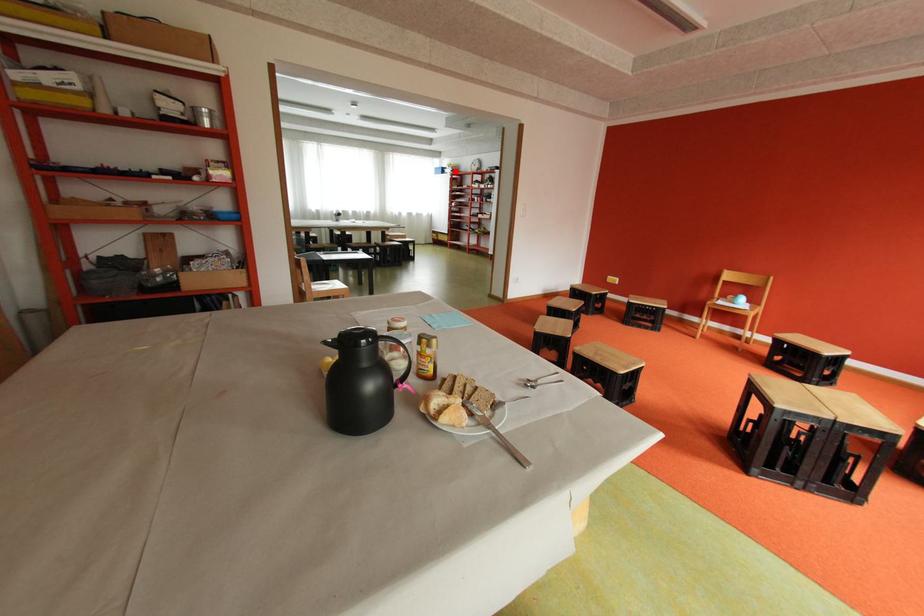
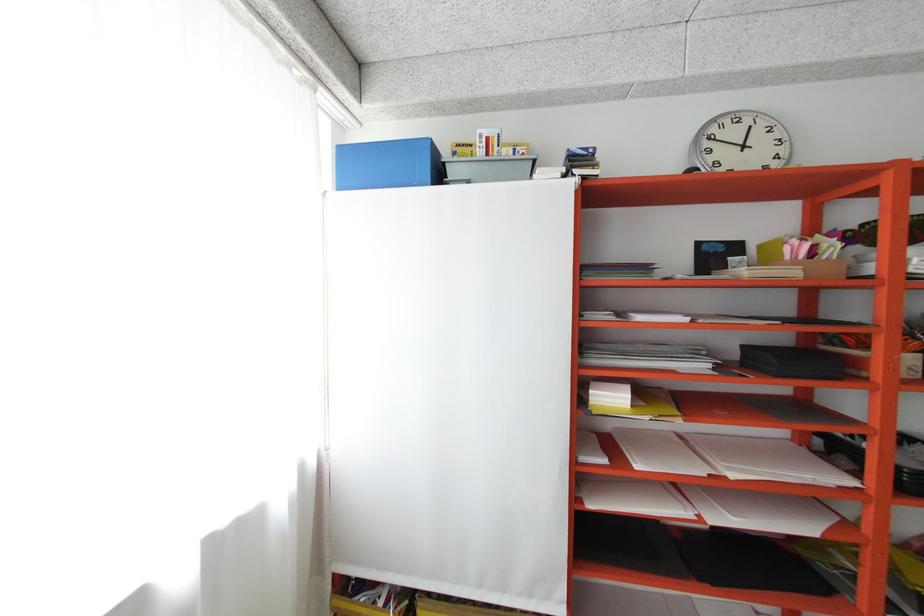
In the second image, find the point that corresponds to the highlighted location in the first image.

(460, 172)